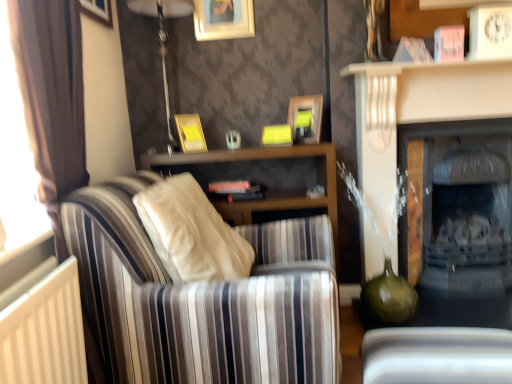
The image size is (512, 384). What do you see at coordinates (203, 299) in the screenshot?
I see `striped fabric couch at left` at bounding box center [203, 299].

In order to face striped fabric couch at left, should I rotate leftwards or rightwards?

You should look left and rotate roughly 2.808 degrees.

Locate an element on the screen. matte white fireplace at right, the first fireplace positioned from the front is located at coordinates (417, 112).

In order to face wooden picture frame at upper center, marked as the 5th picture frame in a bottom-to-top arrangement, should I rotate leftwards or rightwards?

Turn left approximately 4.426 degrees to face it.

You are a GUI agent. You are given a task and a screenshot of the screen. Output one action in this format:
    pyautogui.click(x=<x>, y=<y>)
    Task: Click on the metallic silver table lamp at upper center
    
    Given the screenshot: What is the action you would take?
    pyautogui.click(x=163, y=42)

Looking at this image, is white plastic swivel chair at lower right smaller than matte black fireplace at right, the 2th fireplace viewed from the front?

Correct, white plastic swivel chair at lower right occupies less space than matte black fireplace at right, the 2th fireplace viewed from the front.

Can you tell me how much white plastic swivel chair at lower right and matte black fireplace at right, which is the first fireplace from back to front, differ in facing direction?

The facing directions of white plastic swivel chair at lower right and matte black fireplace at right, which is the first fireplace from back to front, are 83.7 degrees apart.

Is white plastic swivel chair at lower right not inside matte black fireplace at right, the 2th fireplace viewed from the front?

Yes, white plastic swivel chair at lower right is outside of matte black fireplace at right, the 2th fireplace viewed from the front.

Is white plastic swivel chair at lower right far away from matte black fireplace at right, the 2th fireplace viewed from the front?

white plastic swivel chair at lower right is positioned a significant distance from matte black fireplace at right, the 2th fireplace viewed from the front.

From a real-world perspective, is matte white fireplace at right, which appears as the 2th fireplace when viewed from the back, beneath wooden picture frame at upper left, the 1th picture frame positioned from the left?

Yes, from a real-world perspective, matte white fireplace at right, which appears as the 2th fireplace when viewed from the back, is below wooden picture frame at upper left, the 1th picture frame positioned from the left.

Considering the positions of objects matte white fireplace at right, the first fireplace positioned from the front, and wooden picture frame at upper left, which ranks as the 4th picture frame in bottom-to-top order, in the image provided, who is more to the left, matte white fireplace at right, the first fireplace positioned from the front, or wooden picture frame at upper left, which ranks as the 4th picture frame in bottom-to-top order,?

From the viewer's perspective, wooden picture frame at upper left, which ranks as the 4th picture frame in bottom-to-top order, appears more on the left side.

From the image's perspective, which is above, matte white fireplace at right, the first fireplace positioned from the front, or metallic silver table lamp at upper center?

metallic silver table lamp at upper center is shown above in the image.

From a real-world perspective, which is physically above, matte white fireplace at right, which appears as the 2th fireplace when viewed from the back, or metallic silver table lamp at upper center?

From a 3D spatial view, metallic silver table lamp at upper center is above.

Which is correct: matte white fireplace at right, the first fireplace positioned from the front, is inside metallic silver table lamp at upper center, or outside of it?

matte white fireplace at right, the first fireplace positioned from the front, is outside metallic silver table lamp at upper center.

What's the angular difference between matte white fireplace at right, which appears as the 2th fireplace when viewed from the back, and metallic silver table lamp at upper center's facing directions?

0.856 degrees separate the facing orientations of matte white fireplace at right, which appears as the 2th fireplace when viewed from the back, and metallic silver table lamp at upper center.

Between point (484, 364) and point (225, 34), which one is positioned behind?

The point (225, 34) is farther from the camera.

Are white plastic swivel chair at lower right and wooden picture frame at upper center, the 1th picture frame positioned from the top, making contact?

They are not placed beside each other.

Is white plastic swivel chair at lower right to the right of wooden picture frame at upper center, the 1th picture frame positioned from the top, from the viewer's perspective?

Indeed, white plastic swivel chair at lower right is positioned on the right side of wooden picture frame at upper center, the 1th picture frame positioned from the top.

Is white plastic swivel chair at lower right taller or shorter than wooden picture frame at upper center, the third picture frame when ordered from right to left?

white plastic swivel chair at lower right is shorter than wooden picture frame at upper center, the third picture frame when ordered from right to left.

From the image's perspective, is matte gold picture frame at upper center, which is counted as the 1th picture frame, starting from the bottom, on metallic silver table lamp at upper center?

No, from the image's perspective, matte gold picture frame at upper center, which is counted as the 1th picture frame, starting from the bottom, is not above metallic silver table lamp at upper center.

From a real-world perspective, is matte gold picture frame at upper center, the 5th picture frame when ordered from top to bottom, beneath metallic silver table lamp at upper center?

Correct, in the physical world, matte gold picture frame at upper center, the 5th picture frame when ordered from top to bottom, is lower than metallic silver table lamp at upper center.

Considering the sizes of matte gold picture frame at upper center, acting as the fourth picture frame starting from the right, and metallic silver table lamp at upper center in the image, is matte gold picture frame at upper center, acting as the fourth picture frame starting from the right, taller or shorter than metallic silver table lamp at upper center?

Clearly, matte gold picture frame at upper center, acting as the fourth picture frame starting from the right, is shorter compared to metallic silver table lamp at upper center.

Locate an element on the screen. table lamp on the left side of matte gold picture frame at upper center, acting as the fourth picture frame starting from the right is located at coordinates (163, 42).

Can you tell me how much striped fabric couch at left and wooden picture frame at upper center, arranged as the third picture frame when ordered from the bottom, differ in facing direction?

The facing directions of striped fabric couch at left and wooden picture frame at upper center, arranged as the third picture frame when ordered from the bottom, are 110 degrees apart.

Does point (67, 233) lie in front of point (305, 103)?

Yes, it is in front of point (305, 103).

How distant is striped fabric couch at left from wooden picture frame at upper center, arranged as the third picture frame when ordered from the bottom?

striped fabric couch at left and wooden picture frame at upper center, arranged as the third picture frame when ordered from the bottom, are 1.04 meters apart from each other.

Is striped fabric couch at left oriented towards wooden picture frame at upper center, arranged as the third picture frame when ordered from the bottom?

No, striped fabric couch at left is not turned towards wooden picture frame at upper center, arranged as the third picture frame when ordered from the bottom.

Is the depth of yellow matte picture frame at upper center, which ranks as the 4th picture frame in top-to-bottom order, less than that of wooden picture frame at upper center, the third picture frame when ordered from right to left?

Yes, yellow matte picture frame at upper center, which ranks as the 4th picture frame in top-to-bottom order, is closer to the viewer.

Considering the relative sizes of yellow matte picture frame at upper center, which is the fourth picture frame in left-to-right order, and wooden picture frame at upper center, the third picture frame when ordered from right to left, in the image provided, is yellow matte picture frame at upper center, which is the fourth picture frame in left-to-right order, shorter than wooden picture frame at upper center, the third picture frame when ordered from right to left,?

Yes, yellow matte picture frame at upper center, which is the fourth picture frame in left-to-right order, is shorter than wooden picture frame at upper center, the third picture frame when ordered from right to left.

From a real-world perspective, who is located higher, yellow matte picture frame at upper center, which appears as the 2th picture frame when viewed from the right, or wooden picture frame at upper center, the third picture frame when ordered from right to left?

In real-world perspective, wooden picture frame at upper center, the third picture frame when ordered from right to left, is above.

Is yellow matte picture frame at upper center, which is the fourth picture frame in left-to-right order, touching wooden picture frame at upper center, marked as the 5th picture frame in a bottom-to-top arrangement?

No, yellow matte picture frame at upper center, which is the fourth picture frame in left-to-right order, is not in contact with wooden picture frame at upper center, marked as the 5th picture frame in a bottom-to-top arrangement.

This screenshot has width=512, height=384. Identify the location of swivel chair that appears below the matte black fireplace at right, which is the first fireplace from back to front (from a real-world perspective). pyautogui.click(x=437, y=355).

Locate an element on the screen. This screenshot has height=384, width=512. the 1st fireplace counting from the right of the wooden picture frame at upper left, the 1th picture frame positioned from the left is located at coordinates (417, 112).

Based on their spatial positions, is metallic silver table lamp at upper center or wooden picture frame at upper center, which ranks as the fifth picture frame in left-to-right order, further from matte black fireplace at right, which is the first fireplace from back to front?

Based on the image, metallic silver table lamp at upper center appears to be further to matte black fireplace at right, which is the first fireplace from back to front.

Based on their spatial positions, is matte gold picture frame at upper center, which is counted as the 1th picture frame, starting from the bottom, or wooden picture frame at upper left, positioned as the fifth picture frame in right-to-left order, further from metallic silver table lamp at upper center?

wooden picture frame at upper left, positioned as the fifth picture frame in right-to-left order, is further to metallic silver table lamp at upper center.

From the image, which object appears to be nearer to wooden picture frame at upper center, marked as the 5th picture frame in a bottom-to-top arrangement, striped fabric couch at left or white plastic swivel chair at lower right?

striped fabric couch at left.

Looking at the image, which one is located closer to wooden picture frame at upper center, arranged as the 3th picture frame when viewed from the top, striped fabric couch at left or wooden picture frame at upper center, marked as the 5th picture frame in a bottom-to-top arrangement?

wooden picture frame at upper center, marked as the 5th picture frame in a bottom-to-top arrangement.

Looking at the image, which one is located further to wooden picture frame at upper center, arranged as the third picture frame when ordered from the bottom, matte white fireplace at right, which appears as the 2th fireplace when viewed from the back, or matte black fireplace at right, the 2th fireplace viewed from the front?

matte black fireplace at right, the 2th fireplace viewed from the front, lies further to wooden picture frame at upper center, arranged as the third picture frame when ordered from the bottom, than the other object.

From the image, which object appears to be farther from white plastic swivel chair at lower right, metallic silver table lamp at upper center or yellow matte picture frame at upper center, which appears as the 2th picture frame when viewed from the right?

metallic silver table lamp at upper center lies further to white plastic swivel chair at lower right than the other object.

When comparing their distances from wooden picture frame at upper left, the 1th picture frame positioned from the left, does yellow matte picture frame at upper center, which is the fourth picture frame in left-to-right order, or matte black fireplace at right, the 2th fireplace viewed from the front, seem further?

The object further to wooden picture frame at upper left, the 1th picture frame positioned from the left, is matte black fireplace at right, the 2th fireplace viewed from the front.

From the image, which object appears to be nearer to matte white fireplace at right, the first fireplace positioned from the front, striped fabric couch at left or metallic silver table lamp at upper center?

Based on the image, metallic silver table lamp at upper center appears to be nearer to matte white fireplace at right, the first fireplace positioned from the front.

At what (x,y) coordinates should I click in order to perform the action: click on fireplace between matte gold picture frame at upper center, the 5th picture frame when ordered from top to bottom, and matte black fireplace at right, the 2th fireplace viewed from the front, from left to right. Please return your answer as a coordinate pair (x, y). The height and width of the screenshot is (384, 512). Looking at the image, I should click on (417, 112).

Locate an element on the screen. This screenshot has height=384, width=512. table lamp situated between wooden picture frame at upper left, positioned as the fifth picture frame in right-to-left order, and matte white fireplace at right, the first fireplace positioned from the front, from left to right is located at coordinates (163, 42).

Locate an element on the screen. studio couch between matte gold picture frame at upper center, which is counted as the 1th picture frame, starting from the bottom, and matte white fireplace at right, which appears as the 2th fireplace when viewed from the back is located at coordinates (203, 299).

I want to click on fireplace between wooden picture frame at upper center, the 1th picture frame in the right-to-left sequence, and matte black fireplace at right, which is the first fireplace from back to front, in the horizontal direction, so click(x=417, y=112).